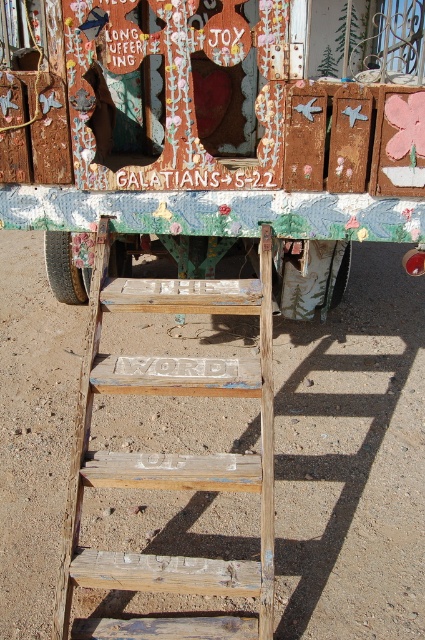
Does rusty metal food truck at center have a smaller size compared to weathered wood ladder at center?

No, rusty metal food truck at center is not smaller than weathered wood ladder at center.

Locate an element on the screen. This screenshot has width=425, height=640. rusty metal food truck at center is located at coordinates (221, 134).

Does rusty metal food truck at center have a greater width compared to white painted wood at center?

Result: Yes.

Between rusty metal food truck at center and white painted wood at center, which one is positioned higher?

rusty metal food truck at center

Locate an element on the screen. Image resolution: width=425 pixels, height=640 pixels. rusty metal food truck at center is located at coordinates (221, 134).

Locate an element on the screen. The width and height of the screenshot is (425, 640). rusty metal food truck at center is located at coordinates (221, 134).

Measure the distance between point (108,298) and camera.

Point (108,298) is 2.72 meters away from camera.

How much distance is there between weathered wood ladder at center and white painted wood at center?

The distance of weathered wood ladder at center from white painted wood at center is 93.70 centimeters.

Which is in front, point (212, 305) or point (255, 188)?

Point (212, 305) is in front.

Where is `weathered wood ladder at center`? The image size is (425, 640). weathered wood ladder at center is located at coordinates (170, 456).